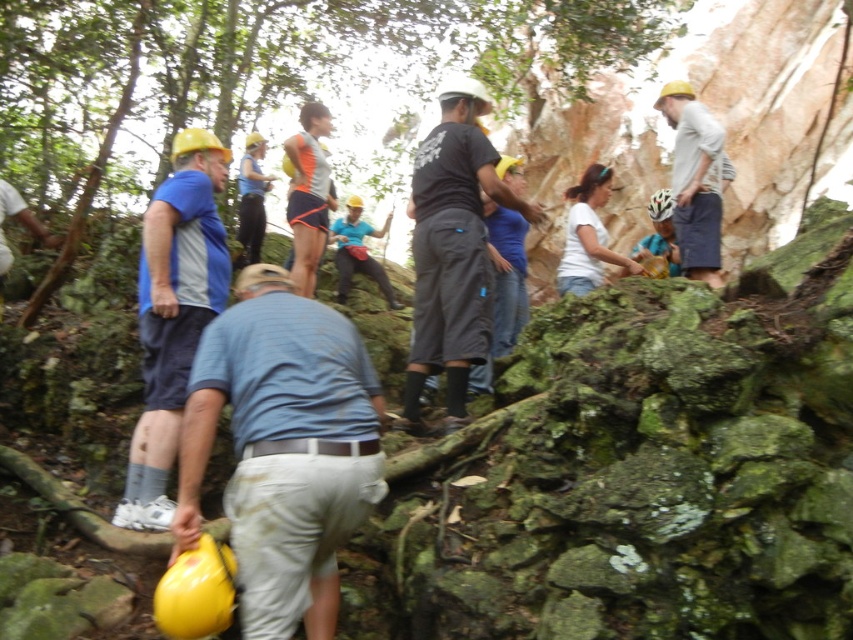
Question: Based on their relative distances, which object is nearer to the blue striped shirt at center?

Choices:
 (A) black matte shorts at center
 (B) blue fabric shirt at left

Answer: (B)

Question: Among these points, which one is farthest from the camera?

Choices:
 (A) (431, 342)
 (B) (149, 291)

Answer: (A)

Question: Which of the following is the closest to the observer?

Choices:
 (A) black matte shorts at center
 (B) blue fabric shirt at left

Answer: (B)

Question: Considering the relative positions of black matte shorts at center and matte white helmet at upper right in the image provided, where is black matte shorts at center located with respect to matte white helmet at upper right?

Choices:
 (A) below
 (B) above

Answer: (A)

Question: Is blue fabric shirt at left closer to the viewer compared to matte white helmet at upper right?

Choices:
 (A) yes
 (B) no

Answer: (A)

Question: Does black matte shorts at center have a larger size compared to matte white helmet at upper right?

Choices:
 (A) no
 (B) yes

Answer: (A)